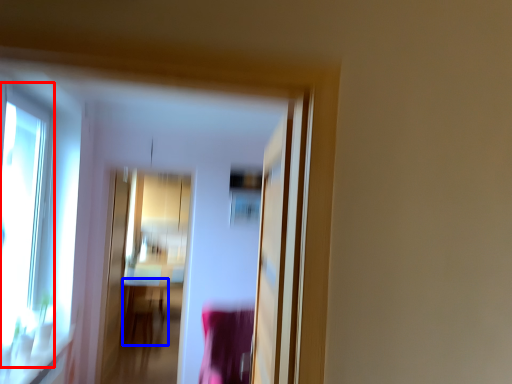
Question: Which of the following is the farthest to the observer, window (highlighted by a red box) or table (highlighted by a blue box)?

Choices:
 (A) window
 (B) table

Answer: (B)